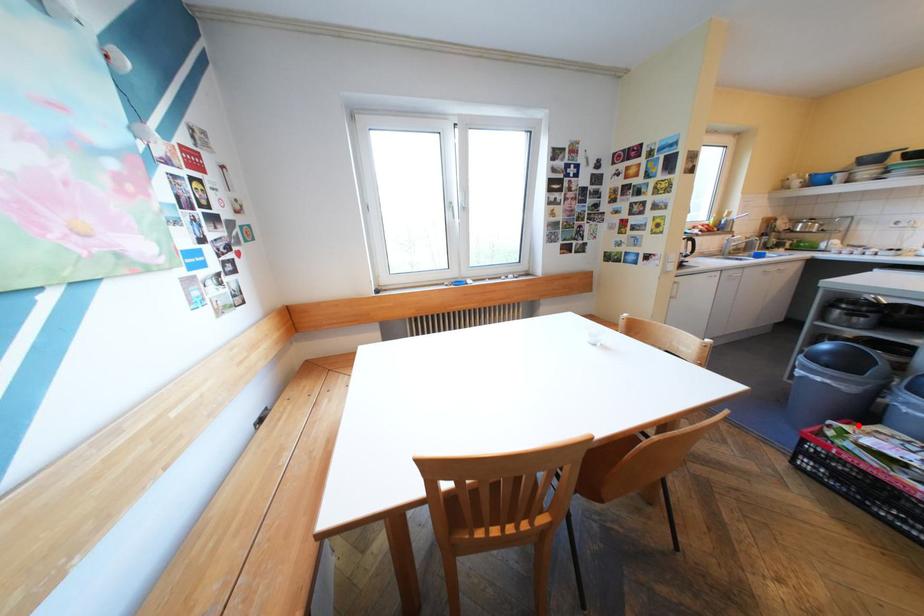
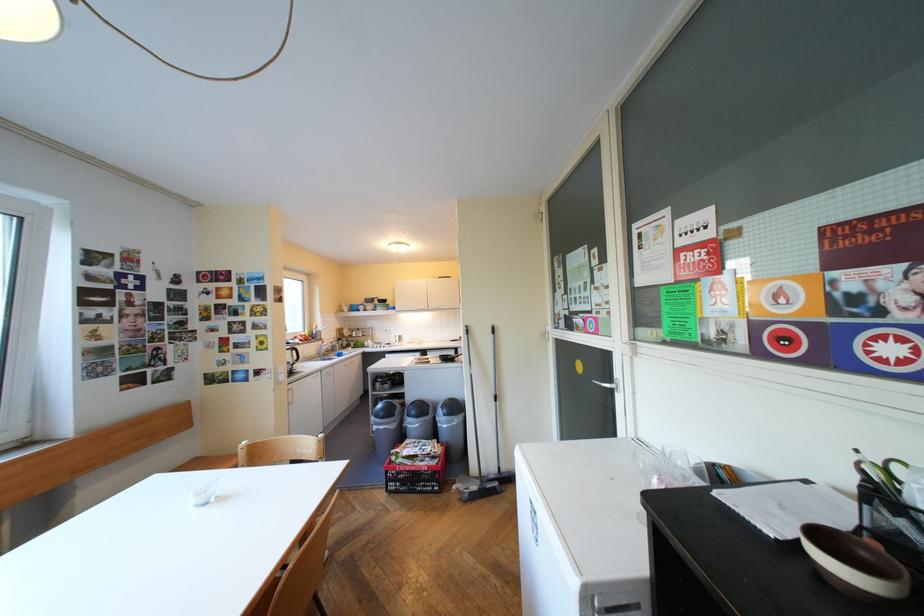
Locate, in the second image, the point that corresponds to the highlighted location in the first image.

(410, 448)